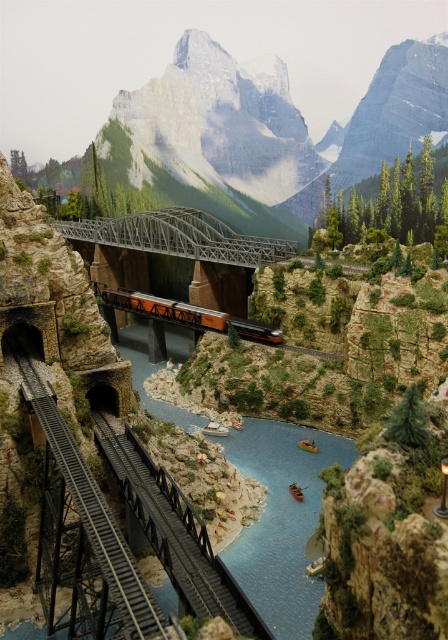
Question: Among these points, which one is farthest from the camera?

Choices:
 (A) (309, 481)
 (B) (123, 300)
 (C) (94, 584)
 (D) (220, 250)

Answer: (B)

Question: Considering the relative positions of black metal train track at lower left and metallic bridge at center in the image provided, where is black metal train track at lower left located with respect to metallic bridge at center?

Choices:
 (A) right
 (B) left

Answer: (B)

Question: Is blue glossy water at center wider than black metal train track at lower left?

Choices:
 (A) yes
 (B) no

Answer: (A)

Question: Which of the following is the closest to the observer?

Choices:
 (A) coord(240,442)
 (B) coord(155,604)
 (C) coord(68,221)

Answer: (B)

Question: Is black metal train track at lower left smaller than metallic silver train at center?

Choices:
 (A) no
 (B) yes

Answer: (B)

Question: Which of the following is the closest to the observer?

Choices:
 (A) black metal train track at lower left
 (B) blue glossy water at center
 (C) metallic bridge at center
 (D) metallic silver train at center

Answer: (A)